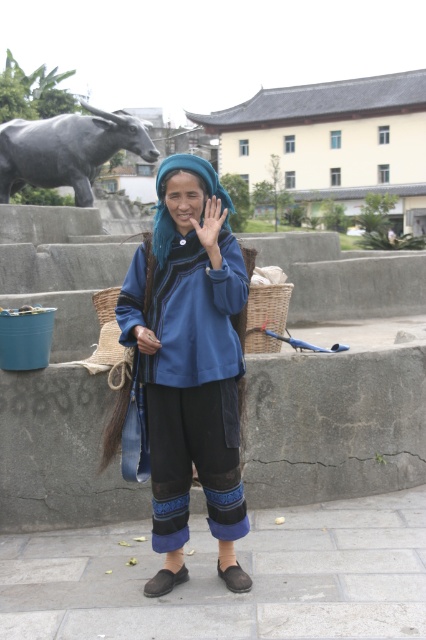
Question: Does woven brown basket at lower center have a larger size compared to woven straw basket at lower left?

Choices:
 (A) yes
 (B) no

Answer: (A)

Question: Which point appears closest to the camera in this image?

Choices:
 (A) (259, 340)
 (B) (0, 202)
 (C) (109, 310)

Answer: (C)

Question: Among these objects, which one is nearest to the camera?

Choices:
 (A) woven brown basket at lower center
 (B) woven straw basket at lower left
 (C) blue woven fabric at center

Answer: (C)

Question: Which point is farther from the camera taking this photo?

Choices:
 (A) (250, 296)
 (B) (103, 317)
 (C) (45, 118)
 (D) (196, 355)

Answer: (C)

Question: Can you confirm if woven brown basket at lower center is smaller than woven straw basket at lower left?

Choices:
 (A) yes
 (B) no

Answer: (B)

Question: Does woven brown basket at lower center appear on the right side of woven straw basket at lower left?

Choices:
 (A) no
 (B) yes

Answer: (B)